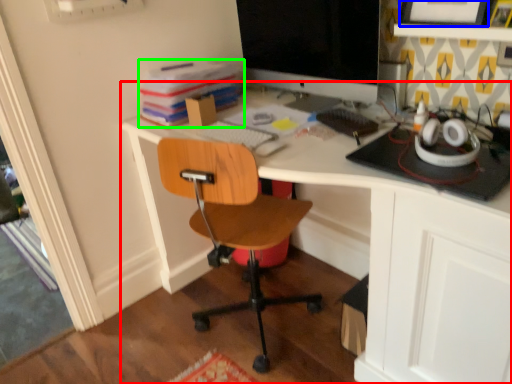
Question: Estimate the real-world distances between objects in this image. Which object is farther from desk (highlighted by a red box), picture frame (highlighted by a blue box) or book (highlighted by a green box)?

Choices:
 (A) picture frame
 (B) book

Answer: (B)